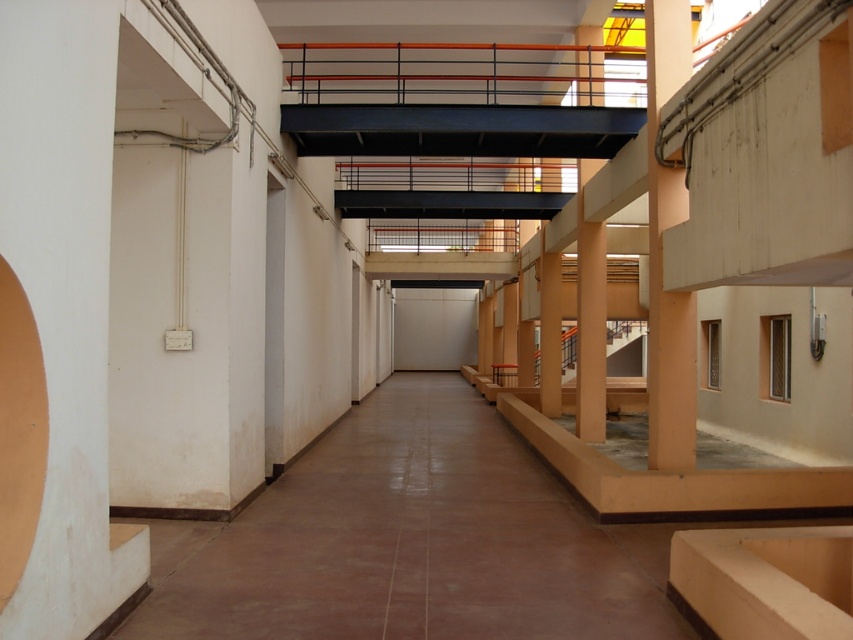
In the scene shown: Does orange matte pillar at right have a greater height compared to orange matte column at center?

Incorrect, orange matte pillar at right's height is not larger of orange matte column at center's.

Can you confirm if orange matte pillar at right is bigger than orange matte column at center?

Actually, orange matte pillar at right might be smaller than orange matte column at center.

Measure the distance between point (672, 412) and camera.

Point (672, 412) and camera are 8.17 meters apart.

Locate an element on the screen. orange matte pillar at right is located at coordinates (660, 253).

Which is more to the left, orange matte pillar at right or orange matte/rough pillar at center-right?

orange matte/rough pillar at center-right is more to the left.

Which of these two, orange matte pillar at right or orange matte/rough pillar at center-right, stands shorter?

Standing shorter between the two is orange matte pillar at right.

Is point (666, 92) in front of point (541, 362)?

Yes, it is in front of point (541, 362).

Where is `orange matte pillar at right`? orange matte pillar at right is located at coordinates (660, 253).

Is orange matte column at center shorter than orange matte/rough pillar at center-right?

In fact, orange matte column at center may be taller than orange matte/rough pillar at center-right.

Between orange matte column at center and orange matte/rough pillar at center-right, which one has more height?

Standing taller between the two is orange matte column at center.

Describe the element at coordinates (590, 332) in the screenshot. I see `orange matte column at center` at that location.

Find the location of a particular element. orange matte column at center is located at coordinates (590, 332).